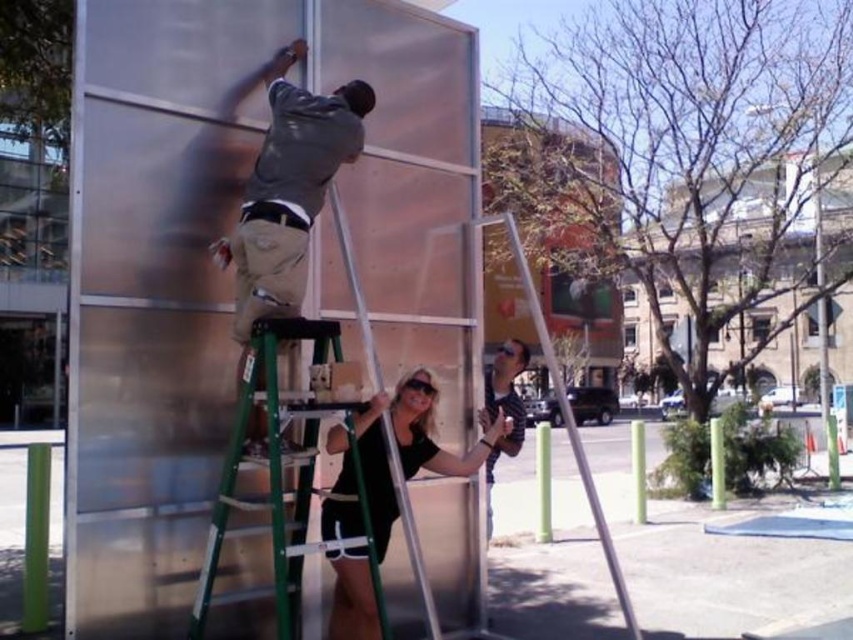
Is green metallic ladder at center bigger than black matte dress at center?

Yes.

Is point (311, 321) in front of point (363, 449)?

Yes, point (311, 321) is closer to viewer.

The width and height of the screenshot is (853, 640). What are the coordinates of `green metallic ladder at center` in the screenshot? It's located at (273, 474).

Does matte gray shirt at upper left appear over striped shirt at center?

Correct, matte gray shirt at upper left is located above striped shirt at center.

Can you confirm if matte gray shirt at upper left is positioned below striped shirt at center?

No, matte gray shirt at upper left is not below striped shirt at center.

Image resolution: width=853 pixels, height=640 pixels. In order to click on matte gray shirt at upper left in this screenshot , I will do `click(288, 189)`.

Is matte gray shirt at upper left above black matte dress at center?

Correct, matte gray shirt at upper left is located above black matte dress at center.

Between matte gray shirt at upper left and black matte dress at center, which one appears on the left side from the viewer's perspective?

Positioned to the left is matte gray shirt at upper left.

The width and height of the screenshot is (853, 640). What do you see at coordinates (288, 189) in the screenshot?
I see `matte gray shirt at upper left` at bounding box center [288, 189].

You are a GUI agent. You are given a task and a screenshot of the screen. Output one action in this format:
    pyautogui.click(x=<x>, y=<y>)
    Task: Click on the matte gray shirt at upper left
    This screenshot has width=853, height=640.
    Given the screenshot: What is the action you would take?
    pyautogui.click(x=288, y=189)